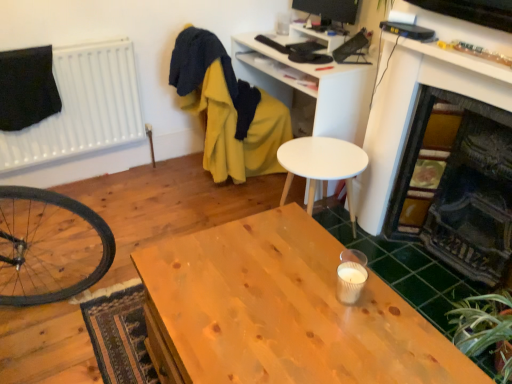
Find the location of `free space above wooden table at center (from a real-world perspective)`. free space above wooden table at center (from a real-world perspective) is located at coordinates (282, 309).